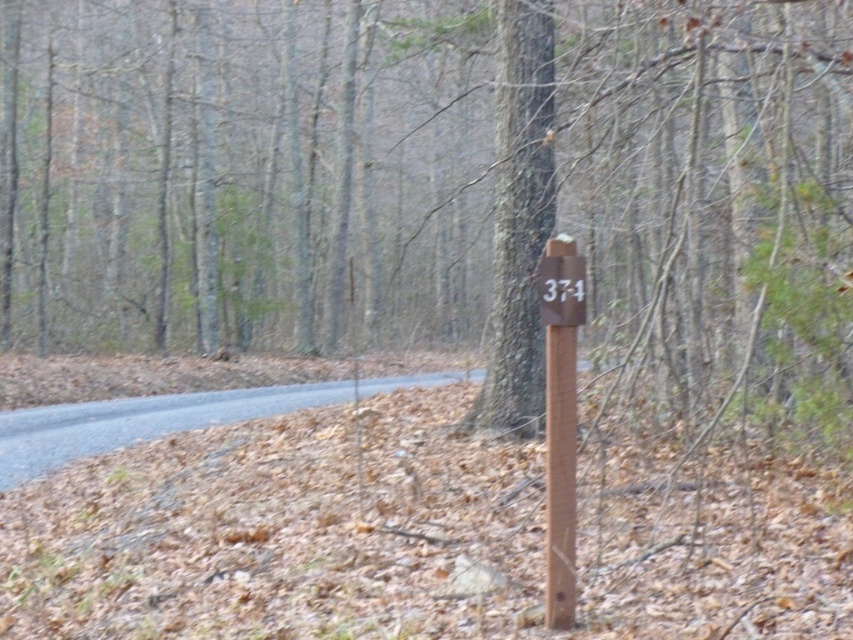
Question: Among these points, which one is nearest to the camera?

Choices:
 (A) (573, 246)
 (B) (544, 305)
 (C) (276, 412)
 (D) (804, 150)

Answer: (A)

Question: Does gray asphalt road at lower left have a larger size compared to brown wooden sign at center?

Choices:
 (A) yes
 (B) no

Answer: (A)

Question: Is brown wood signpost at center below brown wooden post at center?

Choices:
 (A) yes
 (B) no

Answer: (B)

Question: Which point is closer to the camera?

Choices:
 (A) (670, 268)
 (B) (97, 420)
 (C) (554, 426)
 (D) (541, 296)

Answer: (C)

Question: Which of these objects is positioned closest to the gray asphalt road at lower left?

Choices:
 (A) brown wooden sign at center
 (B) brown wooden post at center

Answer: (B)

Question: Where is gray asphalt road at lower left located in relation to brown wooden post at center in the image?

Choices:
 (A) above
 (B) below

Answer: (B)